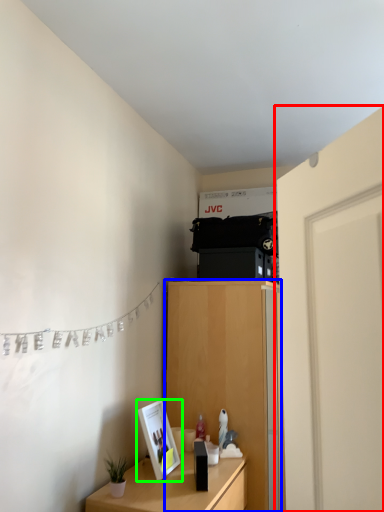
Question: Based on their relative distances, which object is farther from door (highlighted by a red box)? Choose from cabinetry (highlighted by a blue box) and picture frame (highlighted by a green box).

Choices:
 (A) cabinetry
 (B) picture frame

Answer: (A)